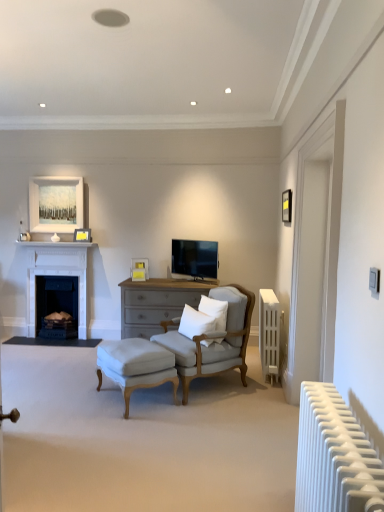
The height and width of the screenshot is (512, 384). I want to click on matte white picture frame at center, the 2th picture frame when ordered from left to right, so click(139, 269).

The height and width of the screenshot is (512, 384). What do you see at coordinates (57, 306) in the screenshot?
I see `dark blue stone fireplace at left, the second fireplace from the top` at bounding box center [57, 306].

Find the location of a particular element. The width and height of the screenshot is (384, 512). dark blue stone fireplace at left, the second fireplace from the top is located at coordinates (57, 306).

Image resolution: width=384 pixels, height=512 pixels. I want to click on white plastic radiator at right, the 1th radiator from the right, so click(269, 333).

In order to face white plastic radiator at right, placed as the 1th radiator when sorted from back to front, should I rotate leftwards or rightwards?

To align with it, rotate right about 10.292°.

Where is `matte black tv at center`? matte black tv at center is located at coordinates click(x=194, y=258).

Locate an element on the screen. This screenshot has width=384, height=512. matte white picture frame at center, the second picture frame when ordered from right to left is located at coordinates (139, 269).

Is white matte radiator at right, placed as the 1th radiator when sorted from left to right, directly adjacent to light gray fabric armchair at center?

No, white matte radiator at right, placed as the 1th radiator when sorted from left to right, is not touching light gray fabric armchair at center.

You are a GUI agent. You are given a task and a screenshot of the screen. Output one action in this format:
    pyautogui.click(x=<x>, y=<y>)
    Task: Click on the chair behind the white matte radiator at right, placed as the 1th radiator when sorted from left to right
    The width and height of the screenshot is (384, 512).
    Given the screenshot: What is the action you would take?
    pyautogui.click(x=214, y=343)

From the image's perspective, is white matte radiator at right, the second radiator in the right-to-left sequence, located above light gray fabric armchair at center?

No, from the image's perspective, white matte radiator at right, the second radiator in the right-to-left sequence, is not over light gray fabric armchair at center.

Could you tell me if white matte radiator at right, the 2th radiator from the back, is turned towards light gray fabric armchair at center?

No, white matte radiator at right, the 2th radiator from the back, is not aimed at light gray fabric armchair at center.

Is white painted wood fireplace at left, the 2th fireplace ordered from the bottom, bigger than matte black picture frame at upper right, placed as the 1th picture frame when sorted from right to left?

Yes, white painted wood fireplace at left, the 2th fireplace ordered from the bottom, is bigger than matte black picture frame at upper right, placed as the 1th picture frame when sorted from right to left.

Is white painted wood fireplace at left, the first fireplace from the top, oriented towards matte black picture frame at upper right, placed as the 1th picture frame when sorted from right to left?

No, white painted wood fireplace at left, the first fireplace from the top, does not turn towards matte black picture frame at upper right, placed as the 1th picture frame when sorted from right to left.

Is the position of white painted wood fireplace at left, the 2th fireplace ordered from the bottom, less distant than that of matte black picture frame at upper right, the 3th picture frame in the back-to-front sequence?

No, the depth of white painted wood fireplace at left, the 2th fireplace ordered from the bottom, is greater than that of matte black picture frame at upper right, the 3th picture frame in the back-to-front sequence.

Can matte black picture frame at upper right, the 3th picture frame in the back-to-front sequence, be found inside white painted wood fireplace at left, the first fireplace from the top?

No.

Measure the distance from dark blue stone fireplace at left, the second fireplace from the top, to white matte radiator at right, the second radiator in the right-to-left sequence.

A distance of 4.35 meters exists between dark blue stone fireplace at left, the second fireplace from the top, and white matte radiator at right, the second radiator in the right-to-left sequence.

Between dark blue stone fireplace at left, the 1th fireplace from the bottom, and white matte radiator at right, placed as the 1th radiator when sorted from left to right, which one has larger size?

Bigger between the two is white matte radiator at right, placed as the 1th radiator when sorted from left to right.

In the scene shown: Considering the sizes of objects dark blue stone fireplace at left, the 1th fireplace from the bottom, and white matte radiator at right, placed as the 1th radiator when sorted from left to right, in the image provided, who is taller, dark blue stone fireplace at left, the 1th fireplace from the bottom, or white matte radiator at right, placed as the 1th radiator when sorted from left to right,?

Standing taller between the two is dark blue stone fireplace at left, the 1th fireplace from the bottom.

Considering the relative positions of dark blue stone fireplace at left, the second fireplace from the top, and white matte radiator at right, the 2th radiator from the back, in the image provided, is dark blue stone fireplace at left, the second fireplace from the top, to the left of white matte radiator at right, the 2th radiator from the back, from the viewer's perspective?

Correct, you'll find dark blue stone fireplace at left, the second fireplace from the top, to the left of white matte radiator at right, the 2th radiator from the back.

Is light gray fabric armchair at center in contact with white soft pillow at center, the first pillow positioned from the right?

No, light gray fabric armchair at center is not beside white soft pillow at center, the first pillow positioned from the right.

Is light gray fabric armchair at center inside or outside of white soft pillow at center, the second pillow when ordered from left to right?

The correct answer is: outside.

Considering the points (213, 290) and (216, 302), which point is in front, point (213, 290) or point (216, 302)?

Point (216, 302)

Measure the distance between white matte radiator at right, which is the 1th radiator from front to back, and white matte picture frame at upper left, the 2th picture frame from the top.

A distance of 4.41 meters exists between white matte radiator at right, which is the 1th radiator from front to back, and white matte picture frame at upper left, the 2th picture frame from the top.

Is white matte radiator at right, the 2th radiator from the back, wider than white matte picture frame at upper left, which appears as the 1th picture frame when viewed from the back?

Yes.

Which object is positioned more to the left, white matte radiator at right, placed as the 1th radiator when sorted from left to right, or white matte picture frame at upper left, which appears as the 2th picture frame when ordered from the bottom?

Positioned to the left is white matte picture frame at upper left, which appears as the 2th picture frame when ordered from the bottom.

From a real-world perspective, which is physically below, white matte radiator at right, which is the 1th radiator from front to back, or white matte picture frame at upper left, the 2th picture frame from the top?

In real-world perspective, white matte radiator at right, which is the 1th radiator from front to back, is lower.

Is matte white picture frame at center, the 2th picture frame when ordered from left to right, positioned behind white matte picture frame at upper left, which appears as the 1th picture frame when viewed from the back?

No, matte white picture frame at center, the 2th picture frame when ordered from left to right, is in front of white matte picture frame at upper left, which appears as the 1th picture frame when viewed from the back.

Who is smaller, matte white picture frame at center, which appears as the second picture frame when viewed from the back, or white matte picture frame at upper left, which ranks as the 1th picture frame in left-to-right order?

With smaller size is white matte picture frame at upper left, which ranks as the 1th picture frame in left-to-right order.

From their relative heights in the image, would you say matte white picture frame at center, which appears as the second picture frame when viewed from the back, is taller or shorter than white matte picture frame at upper left, which appears as the 2th picture frame when ordered from the bottom?

matte white picture frame at center, which appears as the second picture frame when viewed from the back, is taller than white matte picture frame at upper left, which appears as the 2th picture frame when ordered from the bottom.

Looking at this image, from the image's perspective, which one is positioned higher, matte white picture frame at center, which is counted as the second picture frame, starting from the front, or white matte picture frame at upper left, which ranks as the 1th picture frame in left-to-right order?

white matte picture frame at upper left, which ranks as the 1th picture frame in left-to-right order, is shown above in the image.

From the image's perspective, is matte black picture frame at upper right, the 3th picture frame in the back-to-front sequence, located above white soft pillow at center, the second pillow when ordered from left to right?

Indeed, from the image's perspective, matte black picture frame at upper right, the 3th picture frame in the back-to-front sequence, is shown above white soft pillow at center, the second pillow when ordered from left to right.

From a real-world perspective, which object stands above the other?

In real-world perspective, matte black picture frame at upper right, the third picture frame positioned from the bottom, is above.

From a real-world perspective, count 3rd picture frames upward from the white soft pillow at center, the second pillow when ordered from left to right, and point to it. Please provide its 2D coordinates.

[(287, 206)]

Does point (284, 213) come farther from viewer compared to point (219, 324)?

That is True.

Image resolution: width=384 pixels, height=512 pixels. I want to click on radiator that is the 1st object to the right of the light gray fabric armchair at center, starting at the anchor, so click(334, 456).

From a real-world perspective, which picture frame is the 3rd one above the white painted wood fireplace at left, the first fireplace from the top? Please provide its 2D coordinates.

[(287, 206)]

Based on their spatial positions, is light gray fabric ottoman at center or white plastic radiator at right, which appears as the second radiator when viewed from the left, further from white cotton pillow at center, the 2th pillow in the right-to-left sequence?

Among the two, white plastic radiator at right, which appears as the second radiator when viewed from the left, is located further to white cotton pillow at center, the 2th pillow in the right-to-left sequence.

Which object lies nearer to the anchor point white painted wood fireplace at left, the 2th fireplace ordered from the bottom, white plastic radiator at right, the second radiator viewed from the front, or white cotton pillow at center, the 2th pillow in the right-to-left sequence?

white cotton pillow at center, the 2th pillow in the right-to-left sequence.

Estimate the real-world distances between objects in this image. Which object is further from matte black picture frame at upper right, marked as the first picture frame in a front-to-back arrangement, light gray fabric ottoman at center or white plastic radiator at right, the 1th radiator from the right?

light gray fabric ottoman at center.

Looking at the image, which one is located further to matte black picture frame at upper right, the third picture frame positioned from the bottom, light gray fabric ottoman at center or matte black tv at center?

The object further to matte black picture frame at upper right, the third picture frame positioned from the bottom, is light gray fabric ottoman at center.

Looking at the image, which one is located closer to matte white picture frame at center, the 2th picture frame when ordered from left to right, white plastic radiator at right, which appears as the second radiator when viewed from the left, or white matte radiator at right, which is the 1th radiator from front to back?

white plastic radiator at right, which appears as the second radiator when viewed from the left, is positioned closer to the anchor matte white picture frame at center, the 2th picture frame when ordered from left to right.

Estimate the real-world distances between objects in this image. Which object is further from matte white picture frame at center, the second picture frame when ordered from right to left, matte black tv at center or light gray fabric ottoman at center?

Among the two, light gray fabric ottoman at center is located further to matte white picture frame at center, the second picture frame when ordered from right to left.

Looking at the image, which one is located further to white plastic radiator at right, which appears as the second radiator when viewed from the left, white matte radiator at right, placed as the 1th radiator when sorted from left to right, or light gray fabric ottoman at center?

The object further to white plastic radiator at right, which appears as the second radiator when viewed from the left, is white matte radiator at right, placed as the 1th radiator when sorted from left to right.

Based on the photo, when comparing their distances from white matte radiator at right, the second radiator in the right-to-left sequence, does matte black picture frame at upper right, the 3th picture frame in the back-to-front sequence, or matte black tv at center seem further?

matte black tv at center lies further to white matte radiator at right, the second radiator in the right-to-left sequence, than the other object.

At what (x,y) coordinates should I click in order to perform the action: click on chair positioned between white matte radiator at right, which is the 1th radiator from front to back, and white plastic radiator at right, the second radiator viewed from the front, from near to far. Please return your answer as a coordinate pair (x, y). This screenshot has height=512, width=384. Looking at the image, I should click on click(214, 343).

Locate an element on the screen. television located between light gray fabric ottoman at center and matte white picture frame at center, the 3th picture frame positioned from the top, in the depth direction is located at coordinates (194, 258).

Locate an element on the screen. The image size is (384, 512). television between matte white picture frame at center, the 3th picture frame positioned from the top, and matte black picture frame at upper right, the 3th picture frame from the left, from left to right is located at coordinates (194, 258).

I want to click on chair between white matte radiator at right, the 2th radiator from the back, and matte black picture frame at upper right, marked as the first picture frame in a front-to-back arrangement, along the z-axis, so click(214, 343).